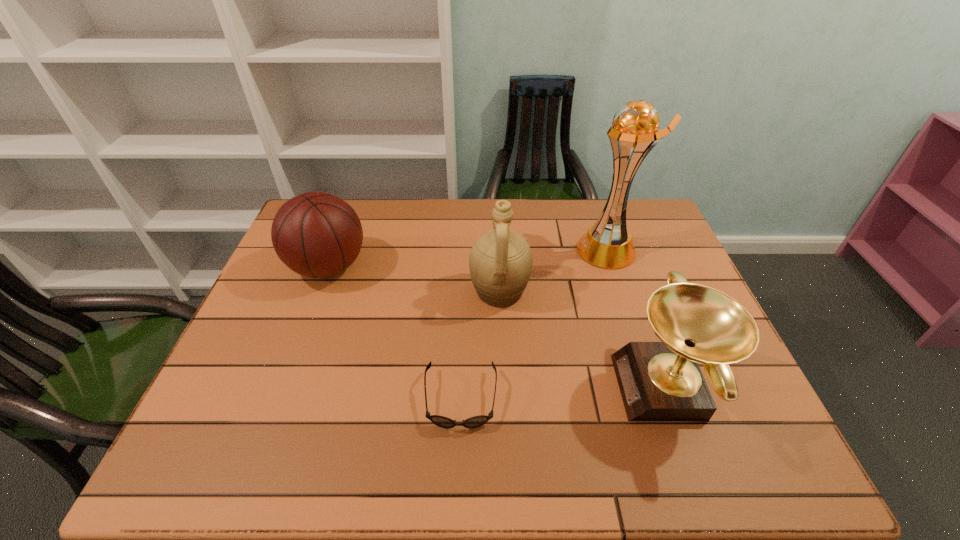
This screenshot has height=540, width=960. In the image, there is a desktop. In order to click on vacant space at the far edge in this screenshot , I will do `click(431, 217)`.

This screenshot has height=540, width=960. I want to click on blank space at the near edge of the desktop, so click(400, 453).

Identify the location of blank space at the left edge. (245, 343).

In the image, there is a desktop. Find the location of `vacant space at the right edge`. vacant space at the right edge is located at coordinates (660, 273).

The width and height of the screenshot is (960, 540). In order to click on vacant space at the near left corner of the desktop in this screenshot , I will do `click(246, 451)`.

This screenshot has width=960, height=540. Identify the location of free spot between the trophy and the basketball. (468, 258).

The image size is (960, 540). Identify the location of free space between the trophy and the fourth shortest object. (554, 271).

Find the location of a particular element. The height and width of the screenshot is (540, 960). blank region between the sunglasses and the pitcher is located at coordinates (480, 345).

Identify the location of free space between the trophy and the sunglasses. The height and width of the screenshot is (540, 960). (535, 325).

Find the location of a particular element. Image resolution: width=960 pixels, height=540 pixels. free point between the leftmost object and the award is located at coordinates (497, 327).